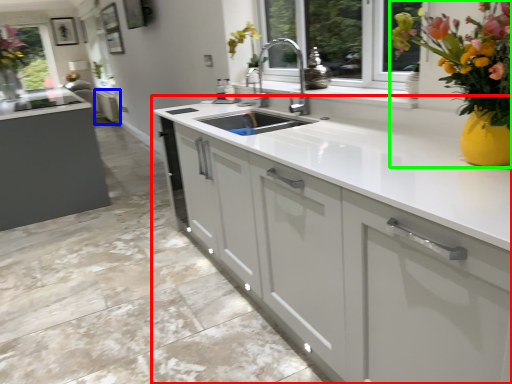
Question: Which object is positioned closest to cabinetry (highlighted by a red box)? Select from cabinetry (highlighted by a blue box) and floral arrangement (highlighted by a green box).

Choices:
 (A) cabinetry
 (B) floral arrangement

Answer: (B)